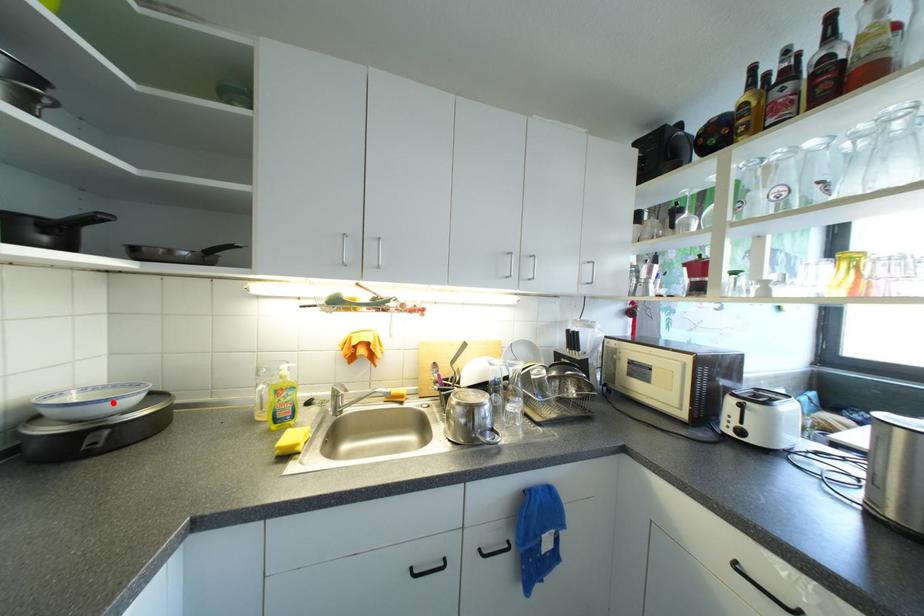
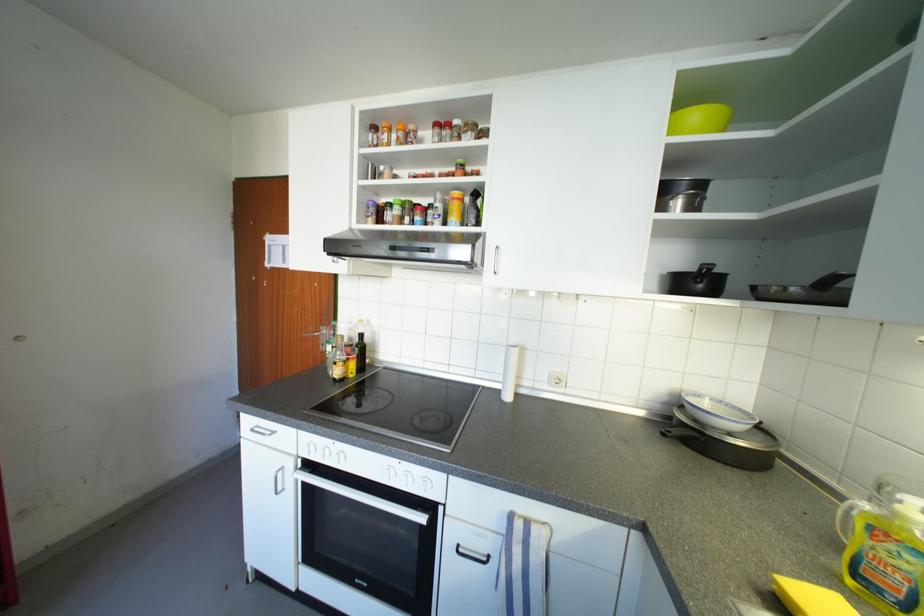
Where in the second image is the point corresponding to the highlighted location from the first image?

(713, 416)